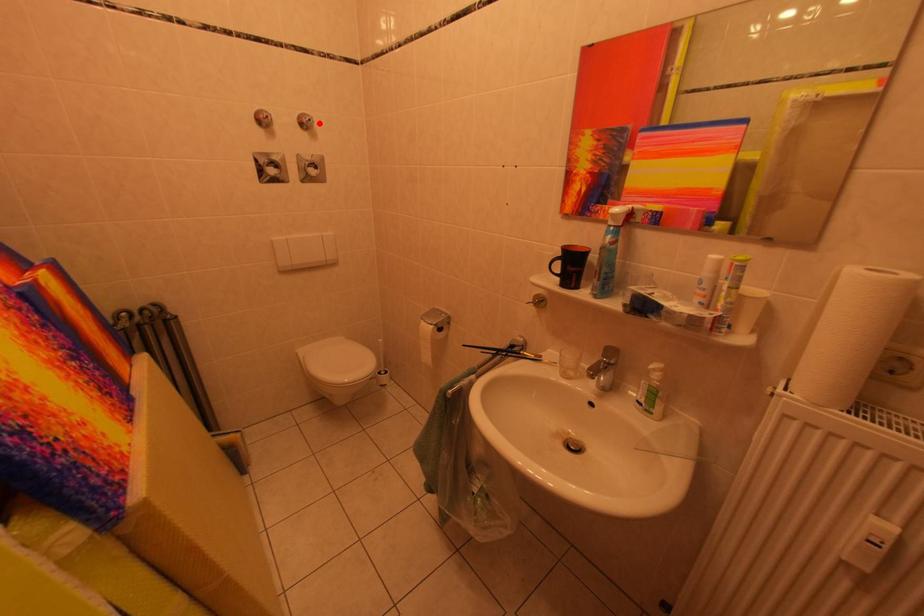
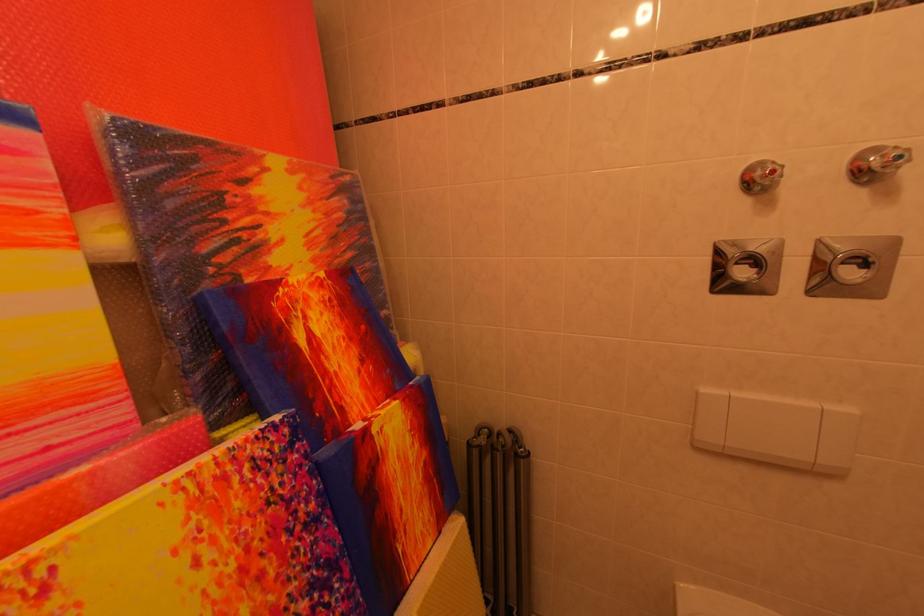
Locate, in the second image, the point that corresponds to the highlighted location in the first image.

(907, 161)